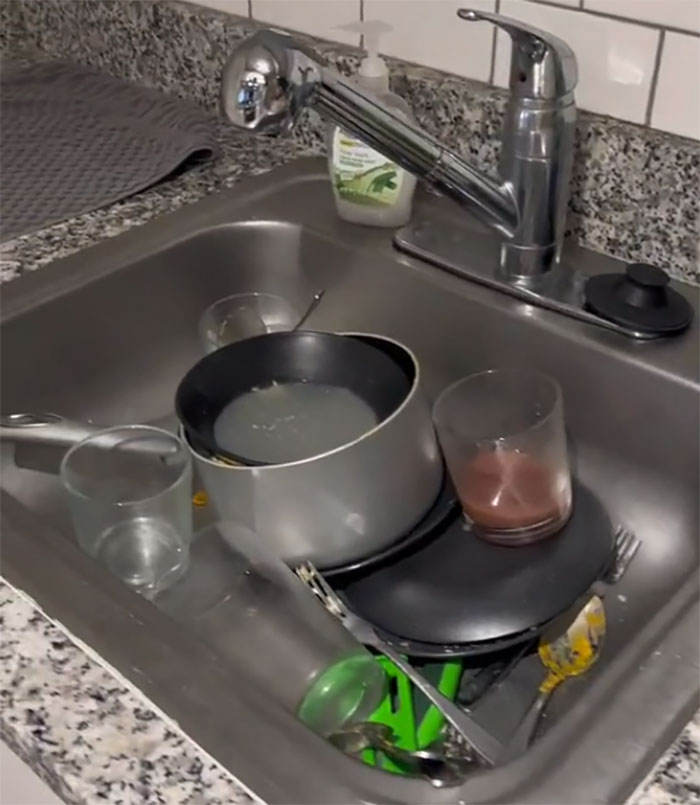
Identify the location of fork. (626, 539), (322, 588).